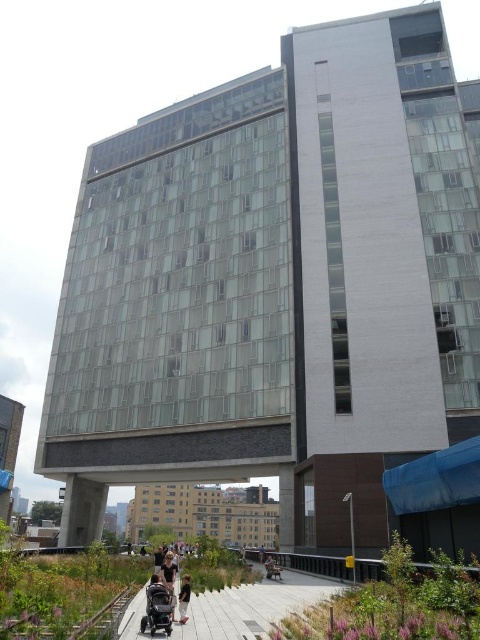
Is point (165, 609) positioned in front of point (180, 611)?

Yes, point (165, 609) is in front of point (180, 611).

Does black matte baby carriage at lower left have a greater height compared to light brown leather jacket at lower center?

No.

Between point (149, 582) and point (188, 604), which one is positioned in front?

Point (188, 604) is more forward.

Locate an element on the screen. This screenshot has width=480, height=640. black matte baby carriage at lower left is located at coordinates (156, 609).

Who is lower down, matte black stroller at lower center or light brown leather jacket at lower center?

matte black stroller at lower center is lower down.

Is matte black stroller at lower center bigger than light brown leather jacket at lower center?

Yes, matte black stroller at lower center is bigger than light brown leather jacket at lower center.

Does point (175, 572) lie behind point (180, 588)?

Yes, it is.

The width and height of the screenshot is (480, 640). What are the coordinates of `matte black stroller at lower center` in the screenshot? It's located at (168, 577).

Does concrete walkway at lower center have a lesser width compared to black matte baby carriage at lower left?

In fact, concrete walkway at lower center might be wider than black matte baby carriage at lower left.

Looking at this image, between concrete walkway at lower center and black matte baby carriage at lower left, which one is positioned higher?

Positioned higher is black matte baby carriage at lower left.

At what (x,y) coordinates should I click in order to perform the action: click on concrete walkway at lower center. Please return your answer as a coordinate pair (x, y). This screenshot has height=640, width=480. Looking at the image, I should click on (252, 605).

Where is `concrete walkway at lower center`? Image resolution: width=480 pixels, height=640 pixels. concrete walkway at lower center is located at coordinates (252, 605).